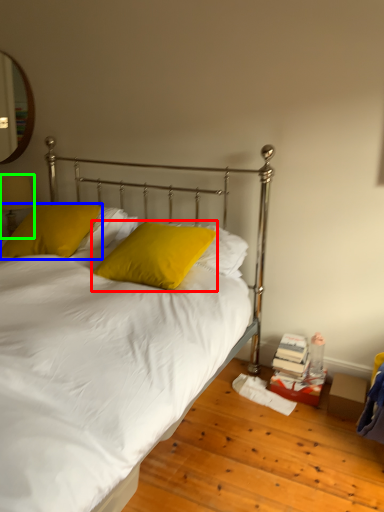
Question: Which object is the farthest from pillow (highlighted by a red box)? Choose among these: pillow (highlighted by a blue box) or table lamp (highlighted by a green box).

Choices:
 (A) pillow
 (B) table lamp

Answer: (B)